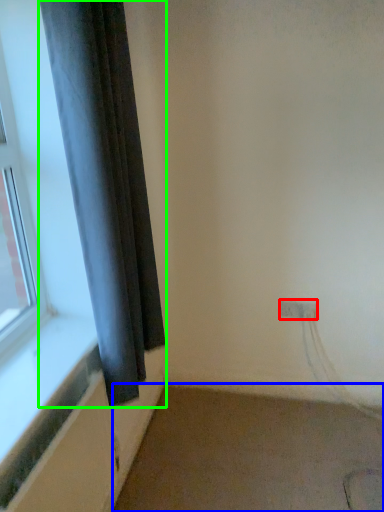
Question: Based on their relative distances, which object is farther from electric outlet (highlighted by a red box)? Choose from plain (highlighted by a blue box) and curtain (highlighted by a green box).

Choices:
 (A) plain
 (B) curtain

Answer: (B)